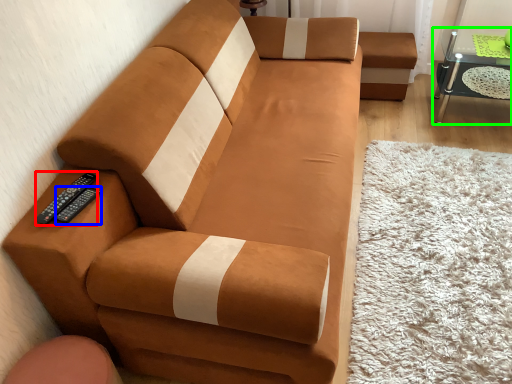
Question: Considering the real-world distances, which object is farthest from remote (highlighted by a red box)? remote (highlighted by a blue box) or table (highlighted by a green box)?

Choices:
 (A) remote
 (B) table

Answer: (B)